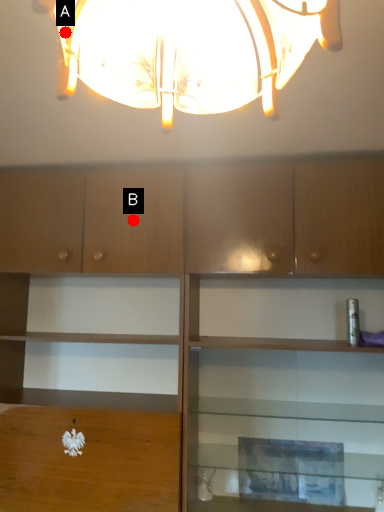
Question: Two points are circled on the image, labeled by A and B beside each circle. Which point is closer to the camera taking this photo?

Choices:
 (A) A is closer
 (B) B is closer

Answer: (A)